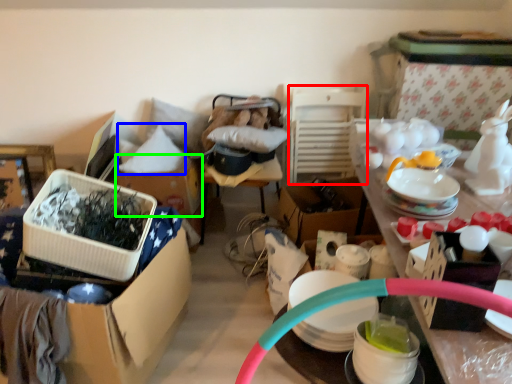
Question: Which is farther away from chair (highlighted by a red box)? pillow (highlighted by a blue box) or cardboard box (highlighted by a green box)?

Choices:
 (A) pillow
 (B) cardboard box

Answer: (A)